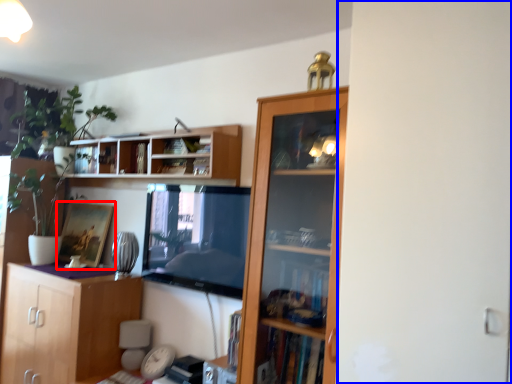
Question: Which object is further to the camera taking this photo, picture frame (highlighted by a red box) or screen door (highlighted by a blue box)?

Choices:
 (A) picture frame
 (B) screen door

Answer: (A)